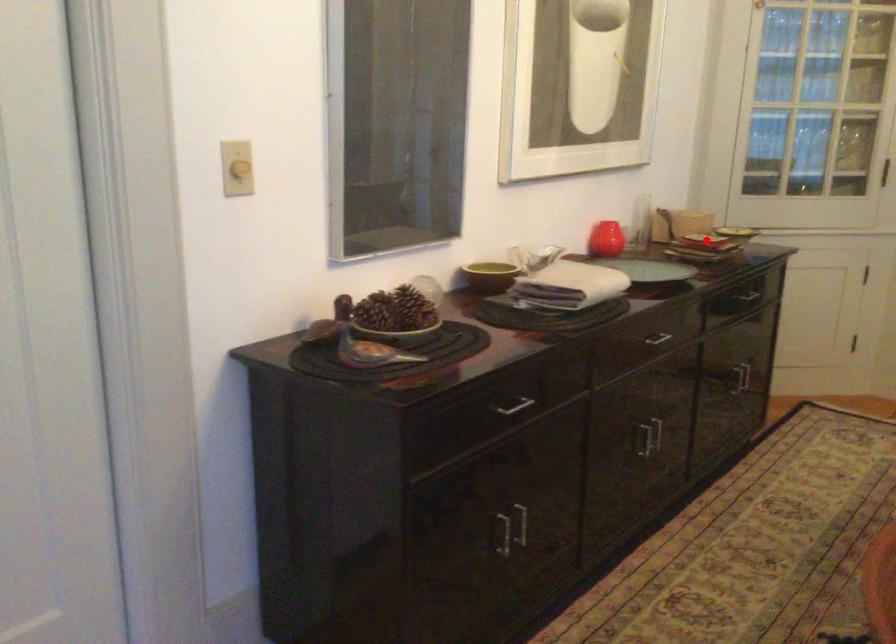
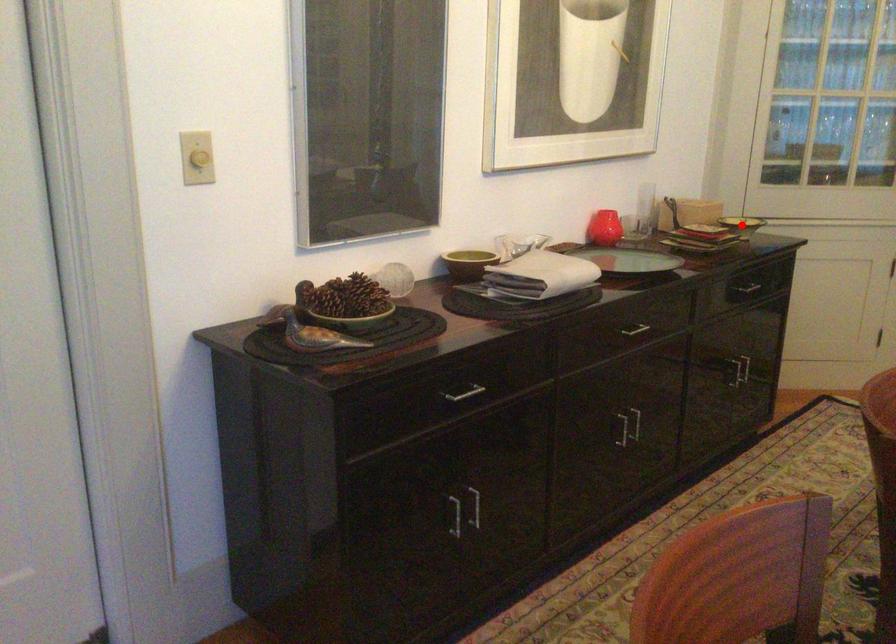
I am providing you with two images of the same scene from different viewpoints. A red point is marked on the first image and another point is marked on the second image. Is the red point in image1 aligned with the point shown in image2?

No